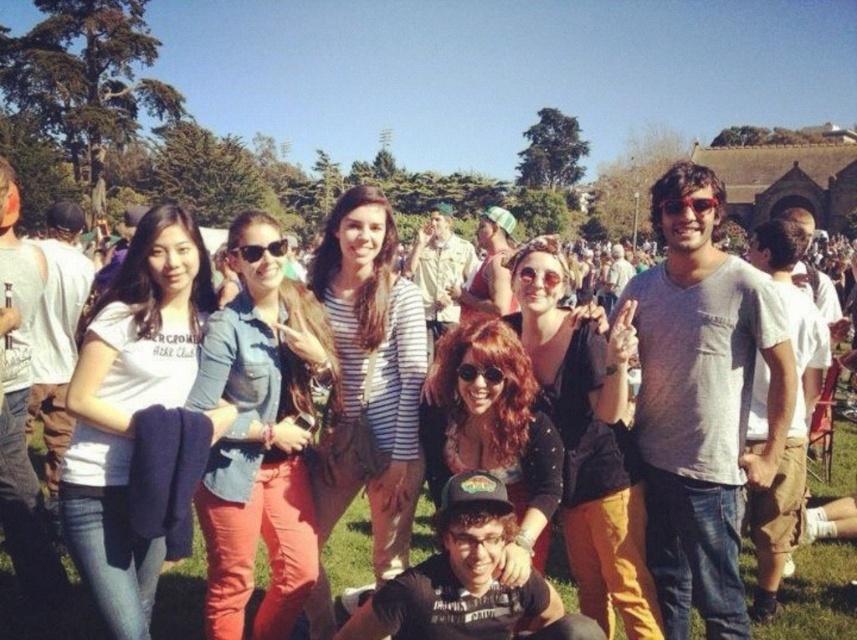
Question: Among these points, which one is farthest from the camera?

Choices:
 (A) (375, 540)
 (B) (247, 276)

Answer: (B)

Question: Which object appears closest to the camera in this image?

Choices:
 (A) denim shirt at center
 (B) white matte shirt at left
 (C) striped shirt at center

Answer: (B)

Question: Can you confirm if denim jacket at center is positioned below shiny red hair at center?

Choices:
 (A) yes
 (B) no

Answer: (A)

Question: Is denim shirt at center smaller than matte black sunglasses at center?

Choices:
 (A) yes
 (B) no

Answer: (A)

Question: Which of the following is the closest to the observer?

Choices:
 (A) pos(556,256)
 (B) pos(100,497)
 (C) pos(835,561)
 (D) pos(244,328)

Answer: (B)

Question: Does striped shirt at center appear on the left side of denim jacket at center?

Choices:
 (A) yes
 (B) no

Answer: (A)